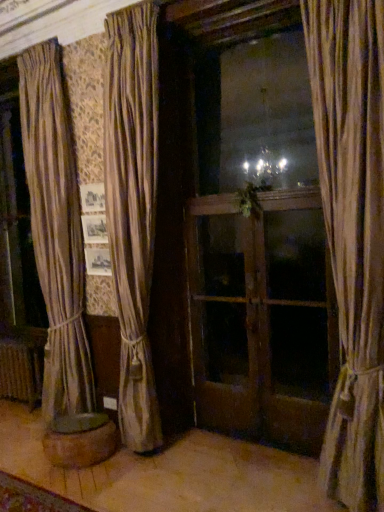
Identify the location of vacant area that lies in front of brown wood stool at lower left. (100, 487).